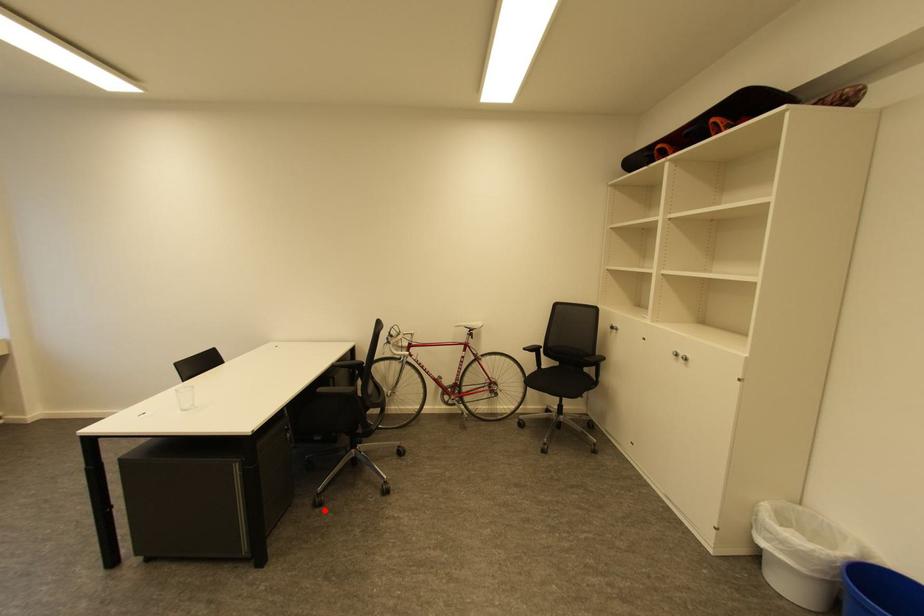
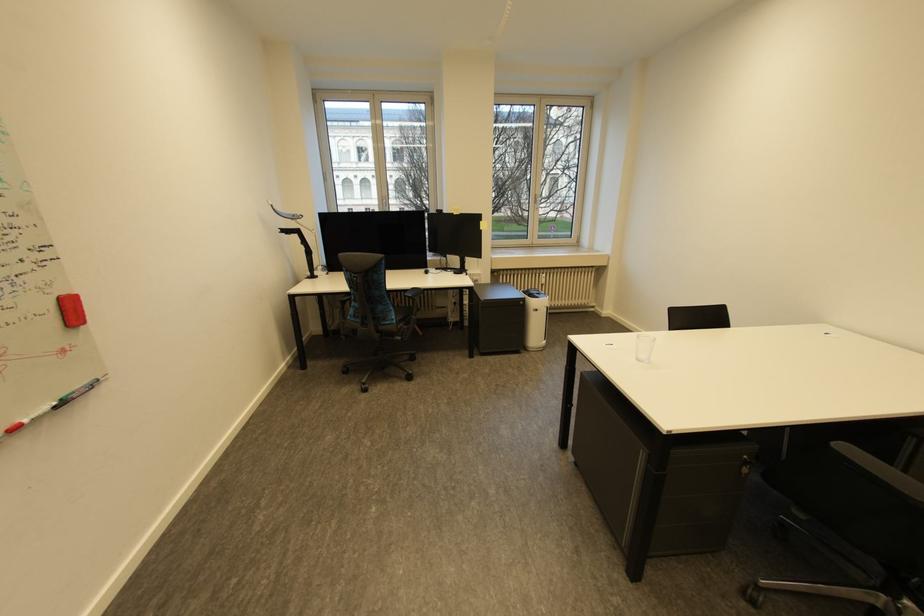
Find the pixel in the second image that matches the highlighted location in the first image.

(750, 604)